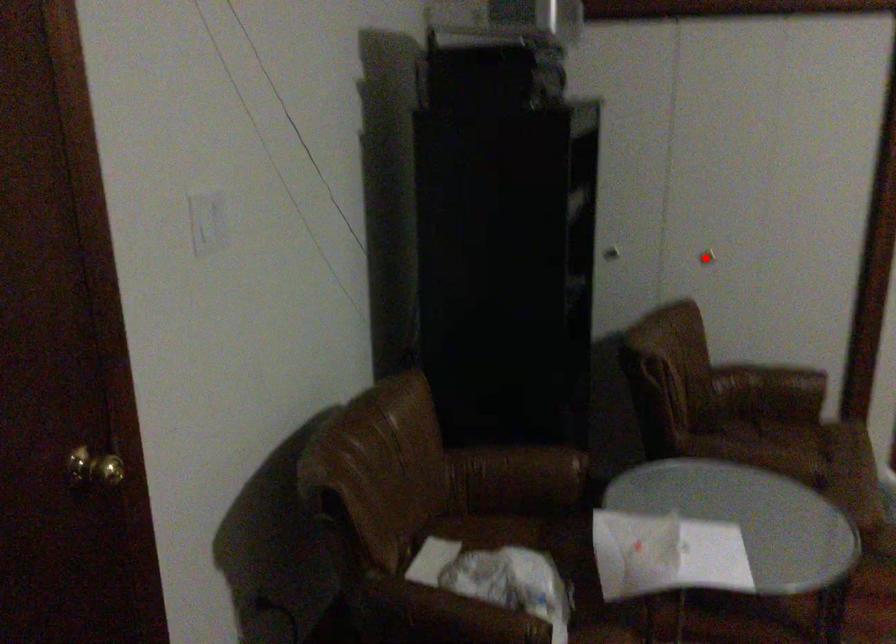
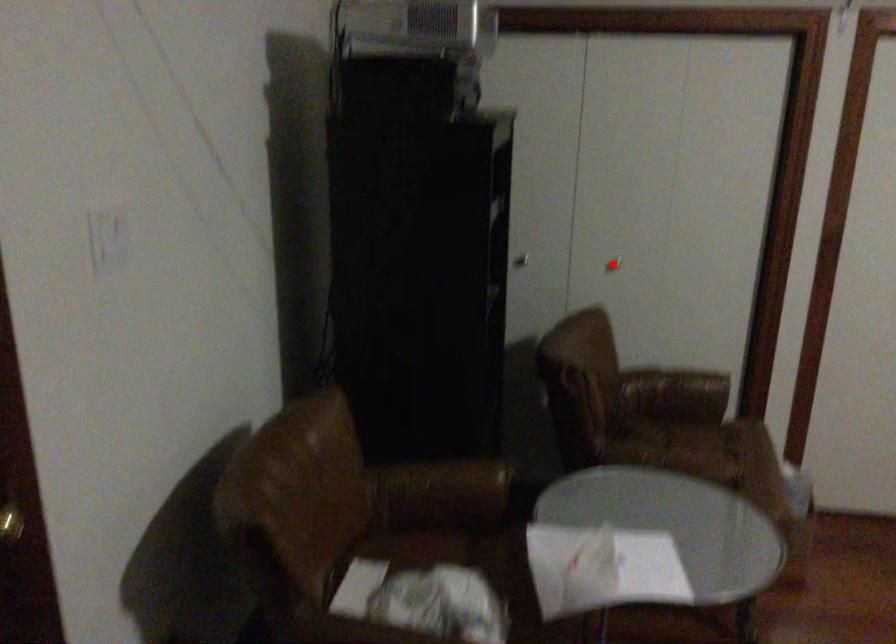
I am providing you with two images of the same scene from different viewpoints. A red point is marked on the first image and another point is marked on the second image. Are the points marked in image1 and image2 representing the same 3D position?

Yes